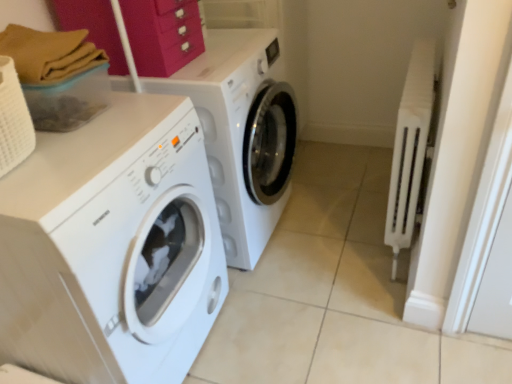
You are a GUI agent. You are given a task and a screenshot of the screen. Output one action in this format:
    pyautogui.click(x=<x>, y=<y>)
    Task: Click on the vacant space situated on the left part of white plastic radiator at right
    
    Given the screenshot: What is the action you would take?
    pyautogui.click(x=326, y=241)